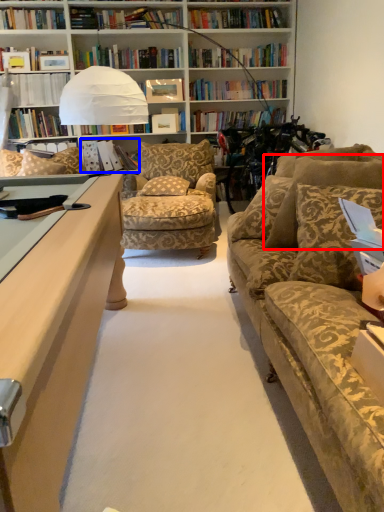
Question: Which point is closer to the camera, pillow (highlighted by a red box) or book (highlighted by a blue box)?

Choices:
 (A) pillow
 (B) book

Answer: (A)